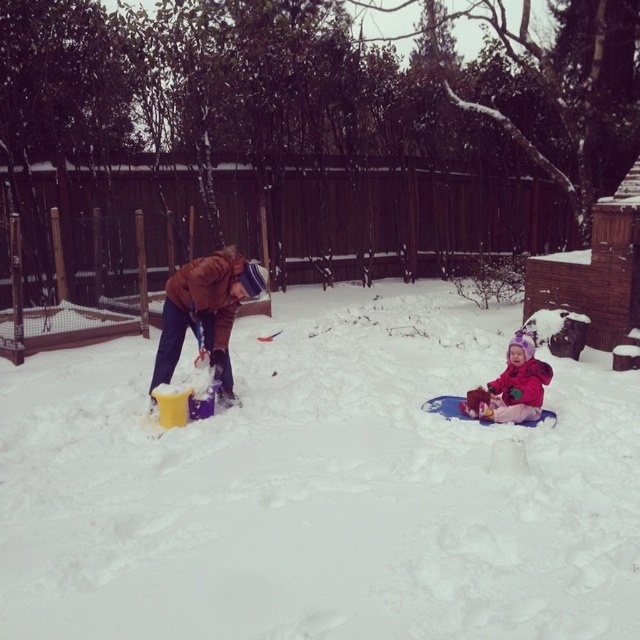
Based on the photo, you are standing at the center of the snowy scene and see the white fluffy snow at center and the fluffy pink snowsuit at lower right. Which object is closer to your right side?

The fluffy pink snowsuit at lower right is closer to your right side because it is positioned to the right of the white fluffy snow at center.

You are standing in the snowy scene and want to place a small flag at the closest point between point (221,577) and point (508,376). Which point should you choose?

Point (221,577) is closer to the viewer than point (508,376), so you should place the flag at point (221,577).

You are a photographer trying to capture both the brown leather jacket at center and the fluffy pink snowsuit at lower right in the same frame. Based on their sizes, which one should you focus on to ensure both are visible without zooming in or out?

The brown leather jacket at center is much taller than the fluffy pink snowsuit at lower right, so focusing on the brown leather jacket at center would allow both to be visible without needing to adjust the zoom.